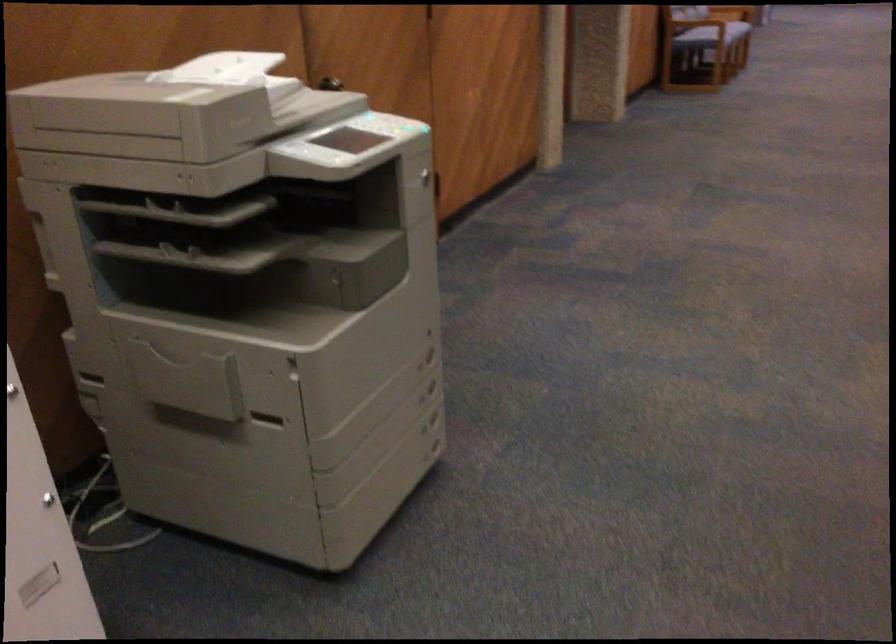
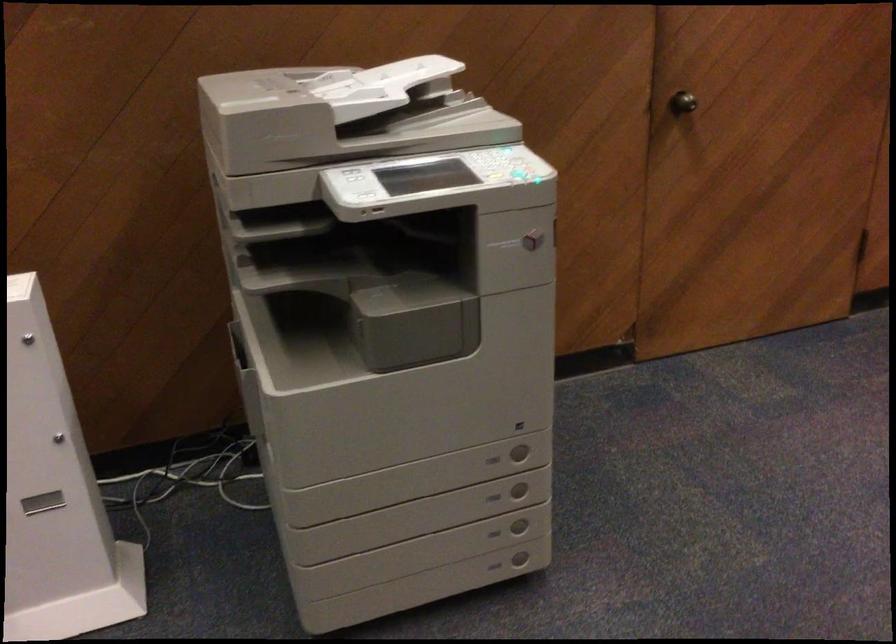
In the second image, find the point that corresponds to pixel 426 368 in the first image.

(492, 459)